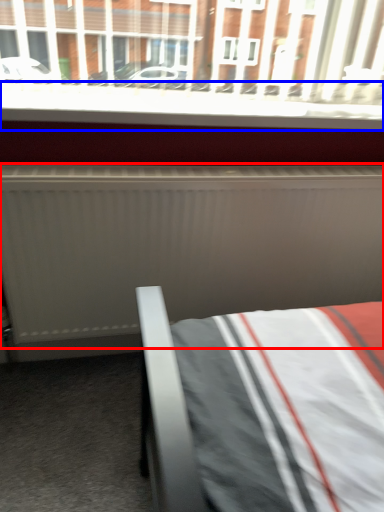
Question: Which of the following is the farthest to the observer, radiator (highlighted by a red box) or window sill (highlighted by a blue box)?

Choices:
 (A) radiator
 (B) window sill

Answer: (B)